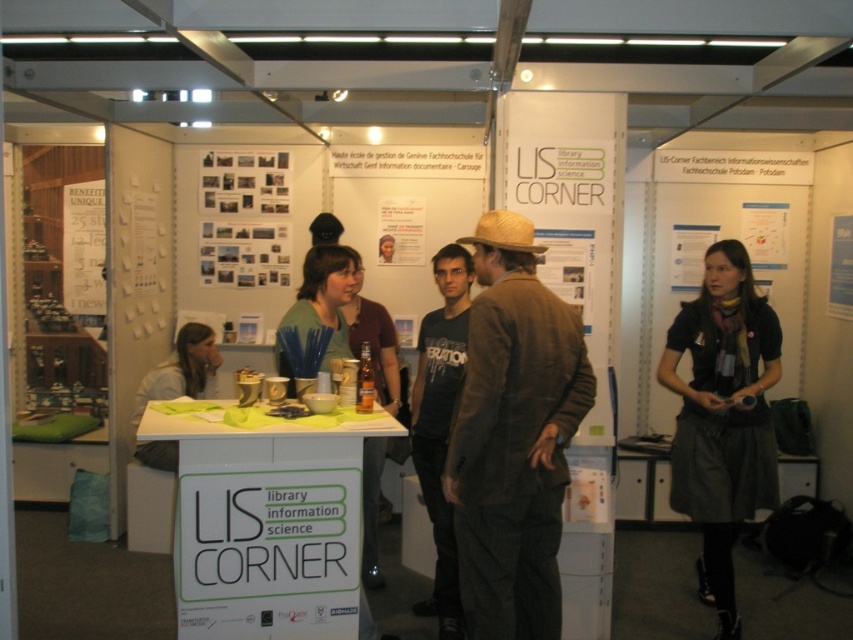
You are an attendee at the LIS CORNER booth and want to place a pen on the white paper at center and the printed paper collage at center. Which object should you place it to the left of to ensure it stays on the correct paper?

You should place the pen to the left of the printed paper collage at center because the white paper at center is on the right side of it.

You are organizing a LIS Corner booth and need to place a new item on the table. The item is wider than the matte paper poster at center. Will it fit next to the brown glass bottle at center?

The matte paper poster at center might be wider than the brown glass bottle at center. Since the new item is wider than the poster, it is likely wider than the bottle as well. However, without knowing the exact width of the bottle, it is uncertain if the new item will fit next to it.